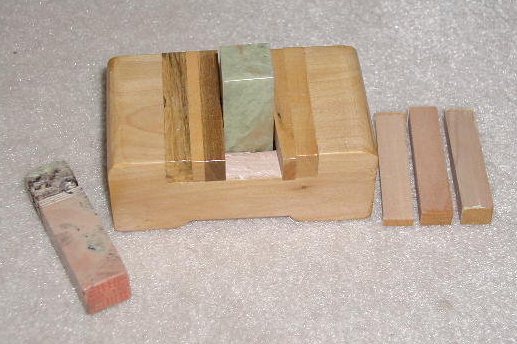
The image size is (517, 344). Find the location of `white carpet`. white carpet is located at coordinates (261, 158), (341, 304).